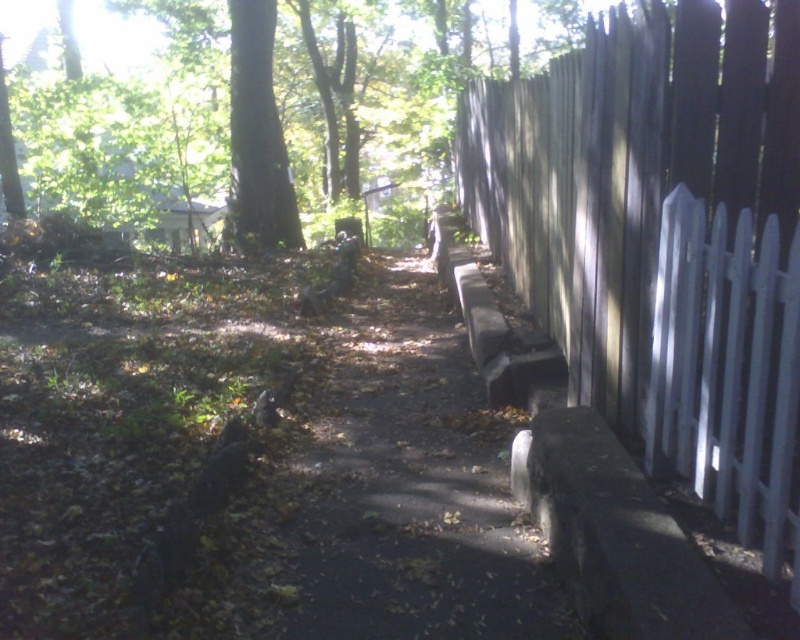
Which is behind, point (520, 124) or point (264, 120)?

The point (264, 120) is behind.

Is wooden picket fence at right above dark brown wood tree at upper center?

Actually, wooden picket fence at right is below dark brown wood tree at upper center.

What are the coordinates of `wooden picket fence at right` in the screenshot? It's located at (662, 241).

Is brown dirt path at center taller than dark brown wood tree at upper center?

In fact, brown dirt path at center may be shorter than dark brown wood tree at upper center.

Is point (310, 516) positioned in front of point (234, 51)?

Yes.

Locate an element on the screen. brown dirt path at center is located at coordinates (404, 490).

Does wooden picket fence at right have a lesser height compared to brown dirt path at center?

Incorrect, wooden picket fence at right's height does not fall short of brown dirt path at center's.

Does wooden picket fence at right appear on the left side of brown dirt path at center?

No, wooden picket fence at right is not to the left of brown dirt path at center.

Where is `wooden picket fence at right`? wooden picket fence at right is located at coordinates (662, 241).